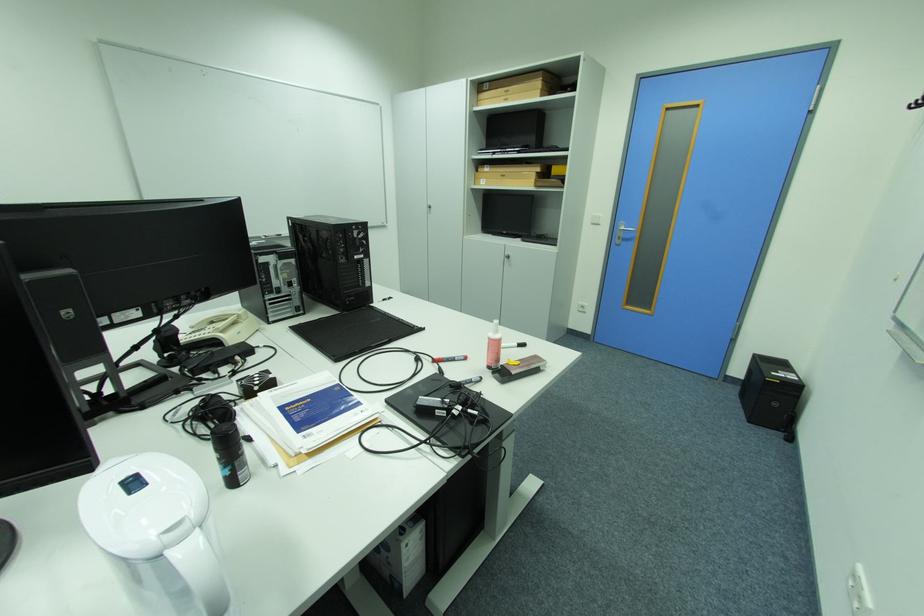
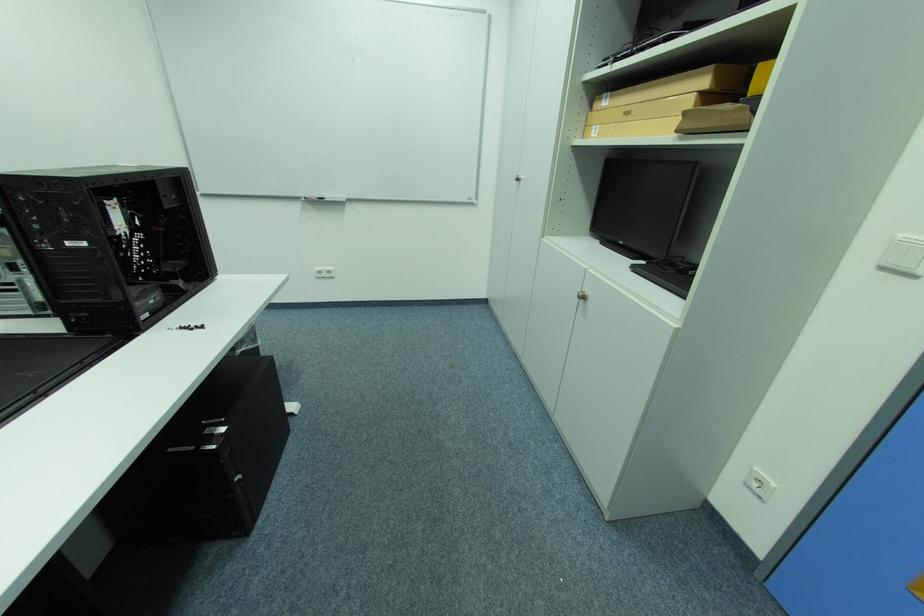
Where in the second image is the point corresponding to pixel 490 180 from the first image?

(602, 128)